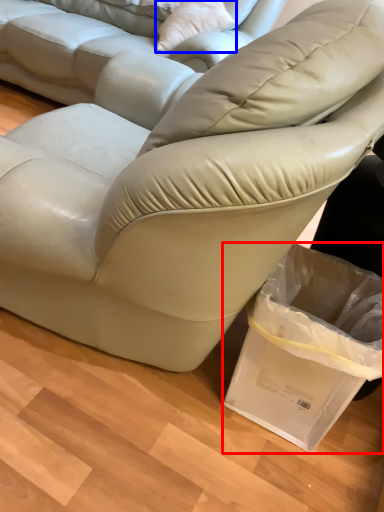
Question: Which object is further to the camera taking this photo, shopping bag (highlighted by a red box) or throw pillow (highlighted by a blue box)?

Choices:
 (A) shopping bag
 (B) throw pillow

Answer: (B)